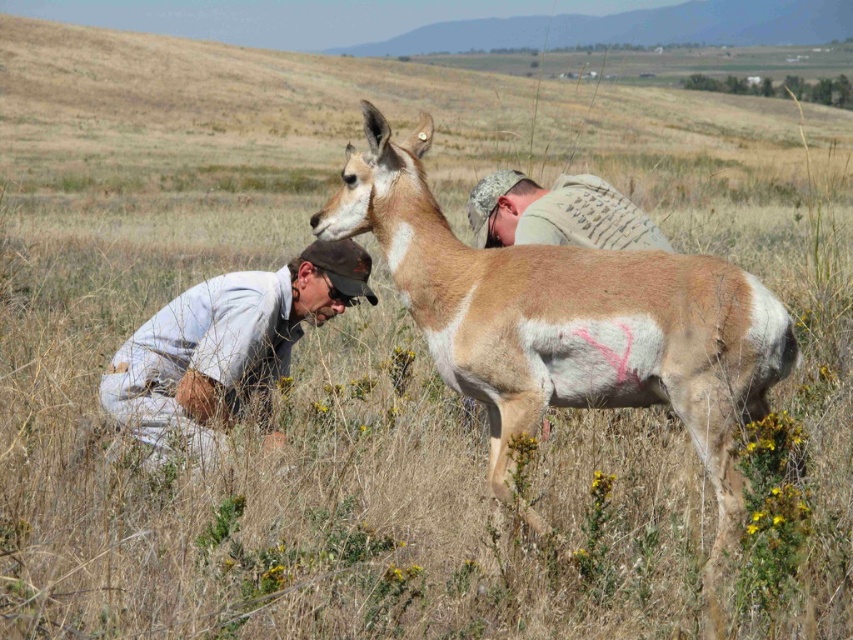
You are a photographer standing in the field and want to take a picture of both the point at (231, 355) and the point at (569, 218). Which point should you focus on first to ensure both are in focus?

You should focus on the point at (231, 355) first because it is closer to the camera than the point at (569, 218), ensuring both points are within the depth of field.

Based on the scene description, can you determine the spatial relationship between the light brown fur at center and the gray fabric shirt at lower left?

The light brown fur at center is located above the gray fabric shirt at lower left.